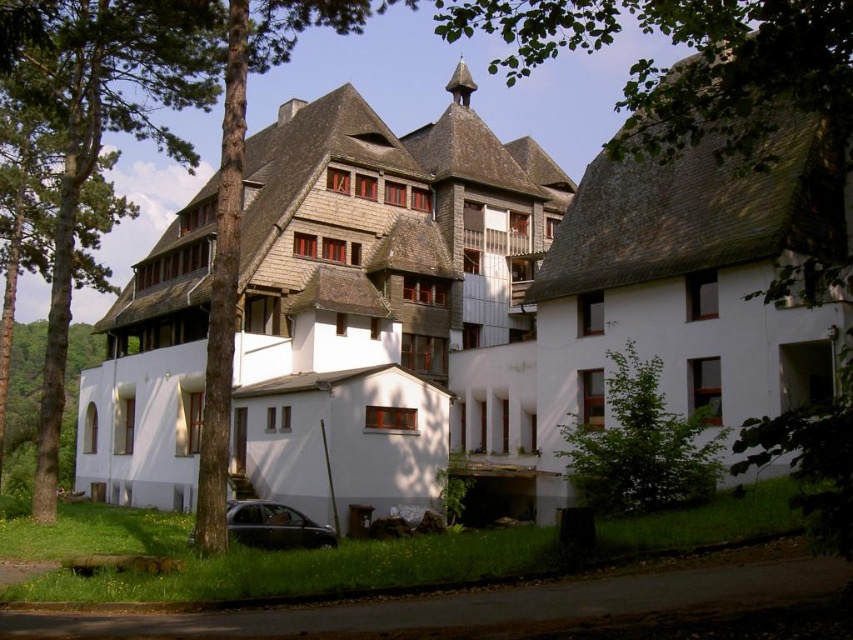
Does green leafy tree at upper center have a greater height compared to green leafy tree at lower right?

Indeed, green leafy tree at upper center has a greater height compared to green leafy tree at lower right.

Does point (590, 8) come closer to viewer compared to point (627, 500)?

No, (590, 8) is further to viewer.

What are the coordinates of `green leafy tree at upper center` in the screenshot? It's located at (689, 64).

Is point (86, 156) farther from viewer compared to point (577, 477)?

That is True.

Which is more to the left, green leafy tree at left or green leafy tree at lower right?

green leafy tree at left is more to the left.

Is point (10, 61) in front of point (698, 483)?

No, it is behind (698, 483).

Where is `green leafy tree at left`? Image resolution: width=853 pixels, height=640 pixels. green leafy tree at left is located at coordinates (100, 125).

Does green leafy tree at lower right have a greater height compared to shiny black car at lower left?

Correct, green leafy tree at lower right is much taller as shiny black car at lower left.

Is point (595, 428) closer to camera compared to point (276, 525)?

No, (595, 428) is behind (276, 525).

Locate an element on the screen. green leafy tree at lower right is located at coordinates (640, 445).